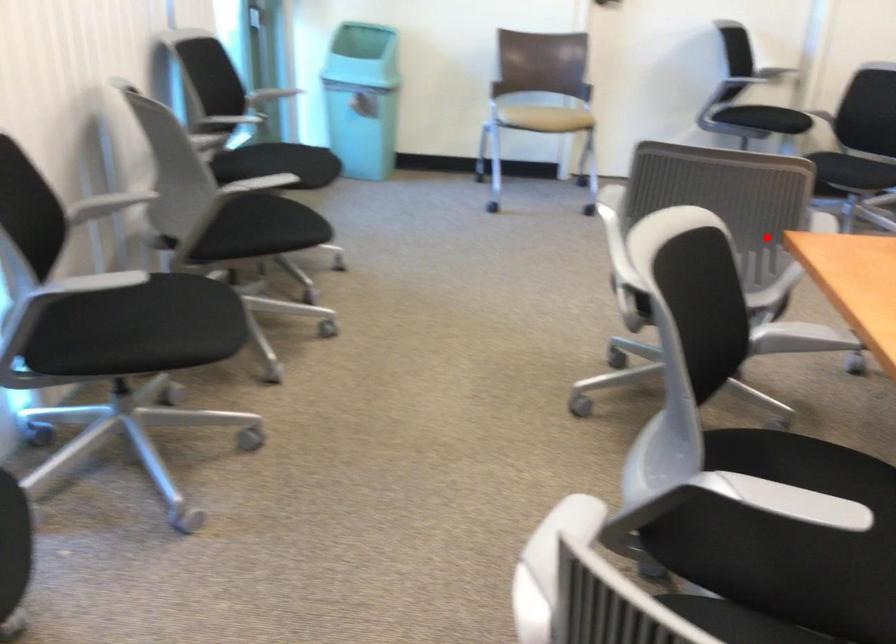
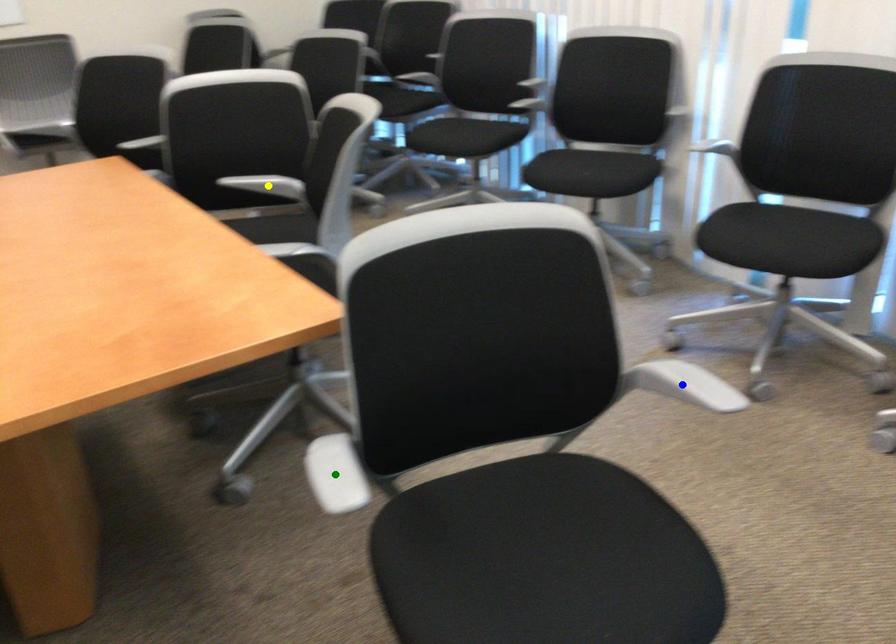
Question: I am providing you with two images of the same scene from different viewpoints. A red point is marked on the first image. You are given multiple points on the second image. In image 2, which mark is for the same physical point as the one in image 1?

Choices:
 (A) yellow point
 (B) green point
 (C) blue point

Answer: (B)